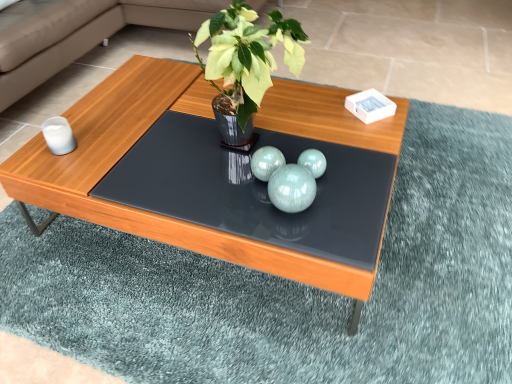
Question: From the image's perspective, is shiny black glass table at center below matte wooden coffee table at center?

Choices:
 (A) no
 (B) yes

Answer: (B)

Question: Considering the relative sizes of shiny black glass table at center and matte wooden coffee table at center in the image provided, is shiny black glass table at center taller than matte wooden coffee table at center?

Choices:
 (A) yes
 (B) no

Answer: (B)

Question: Does shiny black glass table at center lie behind matte wooden coffee table at center?

Choices:
 (A) no
 (B) yes

Answer: (B)

Question: From a real-world perspective, is shiny black glass table at center physically below matte wooden coffee table at center?

Choices:
 (A) no
 (B) yes

Answer: (A)

Question: Can you confirm if shiny black glass table at center is thinner than matte wooden coffee table at center?

Choices:
 (A) no
 (B) yes

Answer: (B)

Question: Is matte wooden coffee table at center located within shiny black glass table at center?

Choices:
 (A) no
 (B) yes

Answer: (A)

Question: Does matte wooden coffee table at center have a greater height compared to shiny black glass table at center?

Choices:
 (A) no
 (B) yes

Answer: (B)

Question: Does matte wooden coffee table at center have a greater width compared to shiny black glass table at center?

Choices:
 (A) yes
 (B) no

Answer: (A)

Question: From the image's perspective, is matte wooden coffee table at center on top of shiny black glass table at center?

Choices:
 (A) yes
 (B) no

Answer: (A)

Question: Is matte wooden coffee table at center shorter than shiny black glass table at center?

Choices:
 (A) yes
 (B) no

Answer: (B)

Question: Does matte wooden coffee table at center have a lesser width compared to shiny black glass table at center?

Choices:
 (A) no
 (B) yes

Answer: (A)

Question: Is matte wooden coffee table at center at the left side of shiny black glass table at center?

Choices:
 (A) yes
 (B) no

Answer: (A)

Question: Does teal glossy spheres at center come in front of green glossy vase at center?

Choices:
 (A) yes
 (B) no

Answer: (B)